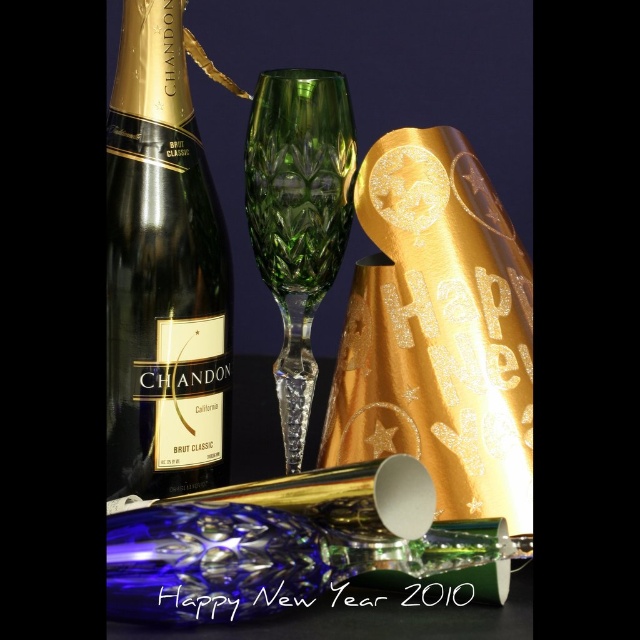
You are planning to pack these items into a gift box. The gift box has a width of 12 cm. The matte gold bottle at left is wider than the green crystal flute at center. Which item should you place first into the box to ensure both items fit?

The matte gold bottle at left is wider than the green crystal flute at center. To ensure both items fit in the gift box, you should place the wider matte gold bottle at left first, followed by the narrower green crystal flute at center, as the bottle requires more space and should be positioned first to optimize the available width.

You are a photographer setting up a New Year photo shoot. You need to place a matte gold bottle at left in the scene. According to the scene description, where should you position it relative to the other objects?

The matte gold bottle at left should be positioned at the coordinates specified in the scene description, which is at point [163,273].

You are organizing a New Year party and need to place the matte gold bottle at left and the green crystal flute at center on a narrow shelf. Which item should you place first to ensure both fit?

The matte gold bottle at left occupies less space than the green crystal flute at center, so place the green crystal flute at center first to ensure both fit on the narrow shelf.